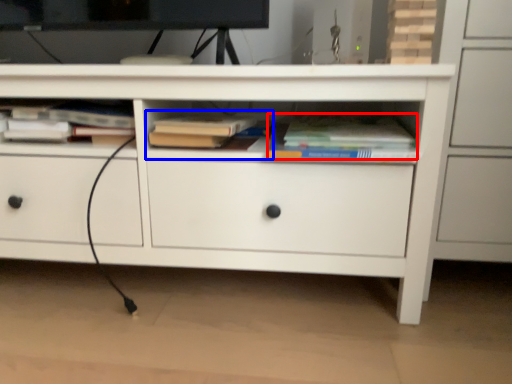
Question: Which object is closer to the camera taking this photo, book (highlighted by a red box) or book (highlighted by a blue box)?

Choices:
 (A) book
 (B) book

Answer: (A)